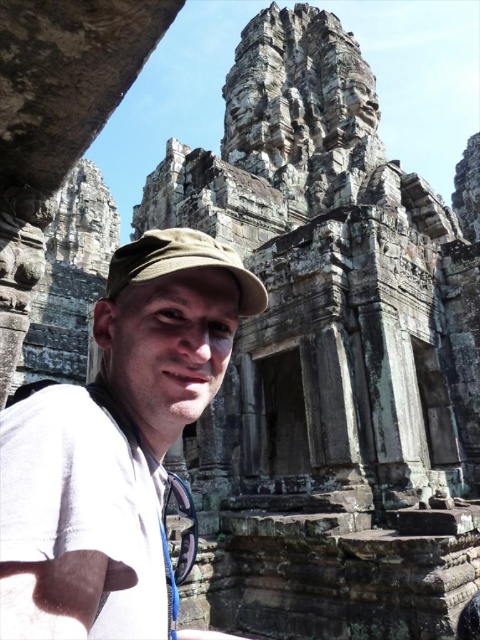
Between white fabric shirt at center and green fabric cap at center, which one appears on the left side from the viewer's perspective?

Positioned to the left is green fabric cap at center.

Looking at this image, between white fabric shirt at center and green fabric cap at center, which one is positioned higher?

Positioned higher is green fabric cap at center.

Locate an element on the screen. white fabric shirt at center is located at coordinates (116, 444).